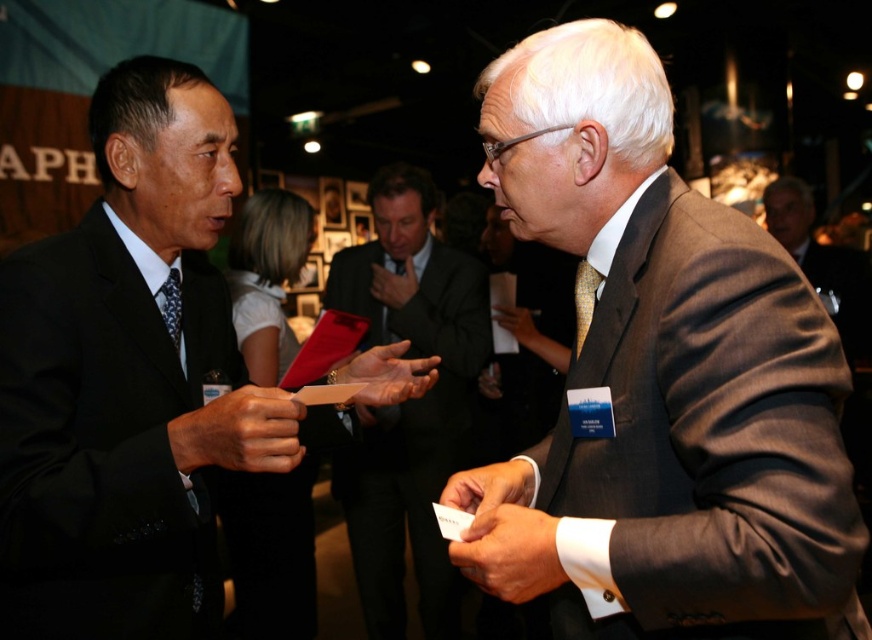
Question: Is matte gray suit at center wider than matte black suit at left?

Choices:
 (A) no
 (B) yes

Answer: (B)

Question: Does matte black suit at center come in front of gray suit at right?

Choices:
 (A) no
 (B) yes

Answer: (B)

Question: Which of these objects is positioned closest to the matte gray suit at center?

Choices:
 (A) gray suit at right
 (B) matte black tie at left
 (C) matte black suit at center
 (D) yellowtexturetie at right

Answer: (D)

Question: Which of the following is the closest to the observer?

Choices:
 (A) (580, 280)
 (B) (847, 269)

Answer: (A)

Question: Is black satin suit at left smaller than matte black suit at center?

Choices:
 (A) yes
 (B) no

Answer: (A)

Question: Which point is farther to the camera?

Choices:
 (A) (379, 561)
 (B) (210, 115)
 (C) (780, 180)
 (D) (124, 616)

Answer: (C)